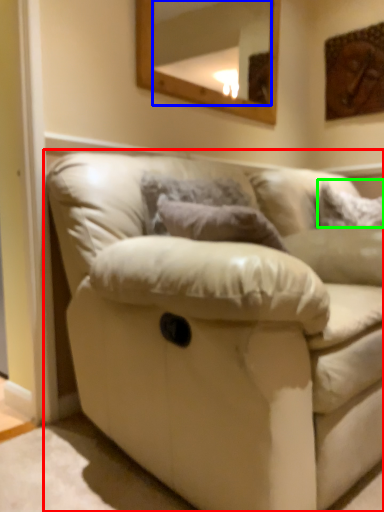
Question: Which is nearer to the studio couch (highlighted by a red box)? mirror (highlighted by a blue box) or pillow (highlighted by a green box).

Choices:
 (A) mirror
 (B) pillow

Answer: (B)